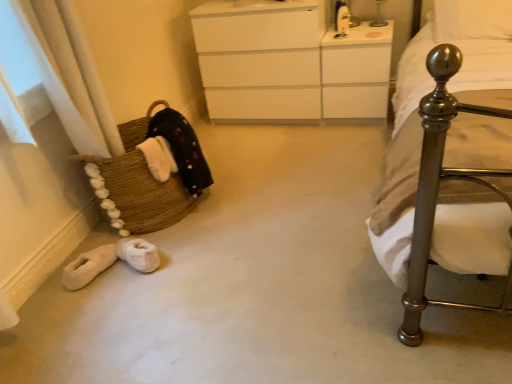
Find the location of `vacant region to the right of brown woven basket at left`. vacant region to the right of brown woven basket at left is located at coordinates (257, 194).